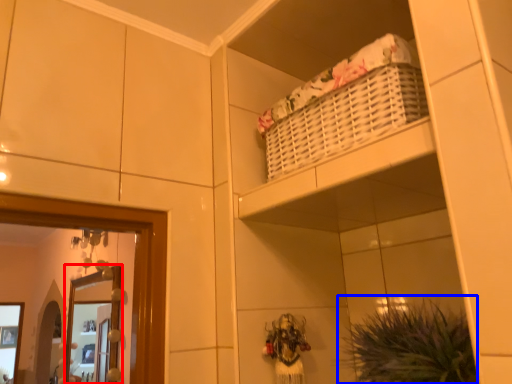
Question: Among these objects, which one is nearest to the camera, mirror (highlighted by a red box) or plant (highlighted by a blue box)?

Choices:
 (A) mirror
 (B) plant

Answer: (B)